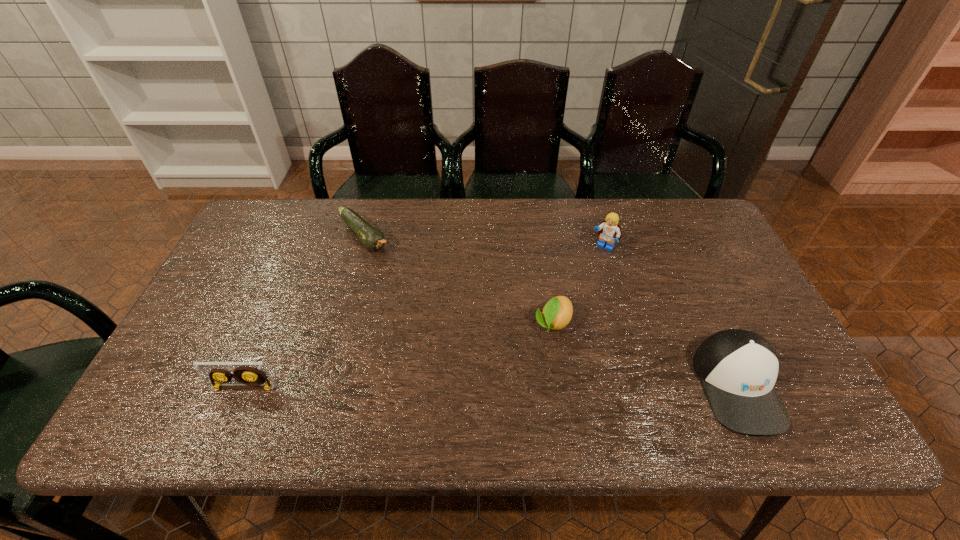
Select which object appears as the third closest to the cap. Please provide its 2D coordinates. Your answer should be formatted as a tuple, i.e. [(x, y)], where the tuple contains the x and y coordinates of a point satisfying the conditions above.

[(372, 238)]